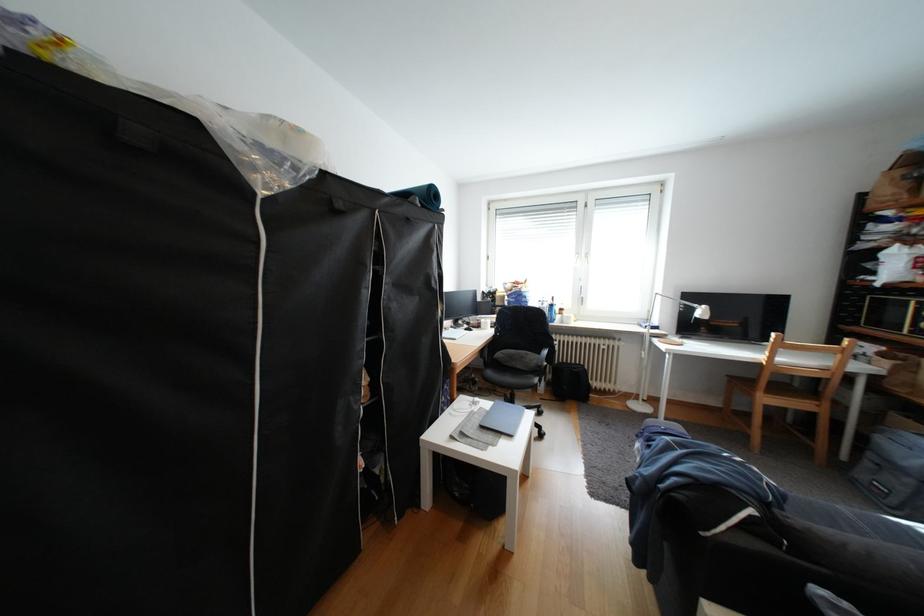
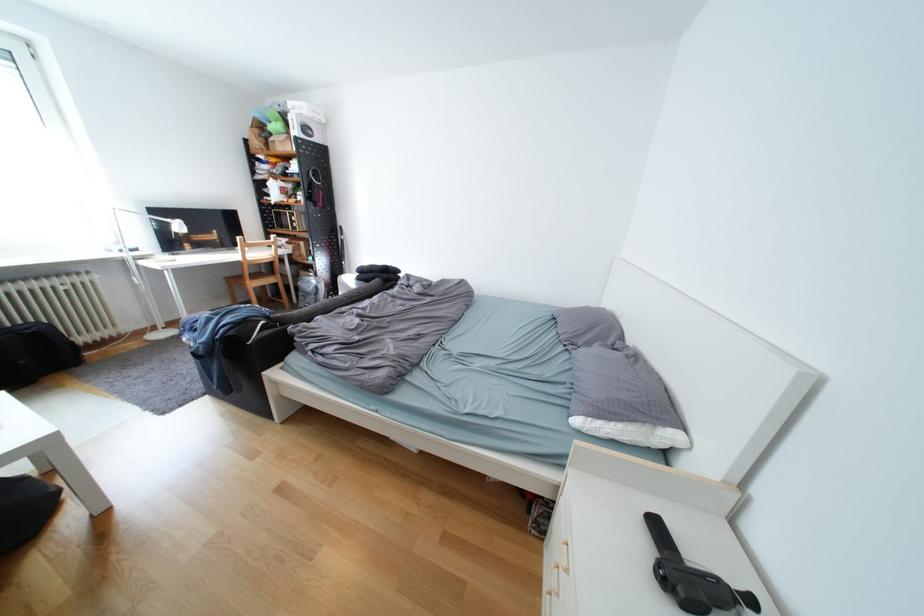
Where in the second image is the point corresponding to (580,363) from the first image?

(14, 330)